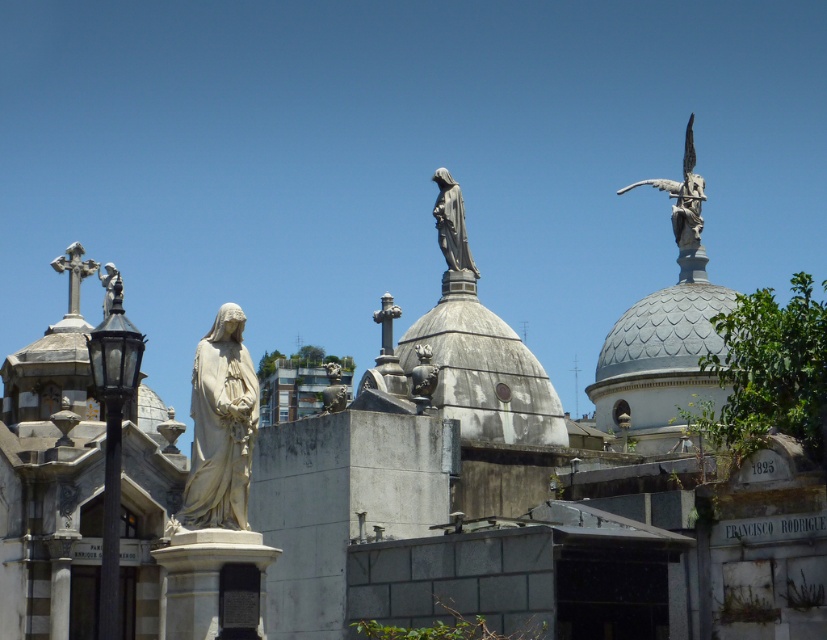
You are a visitor at the cemetery and want to take a photo of the white marble statue at center. To ensure it is the main focus, you need to position yourself so that it is directly in front of you. Given the layout described, where should you stand relative to the other statues and structures in the scene?

The white marble statue at center is located at point (220, 426), so you should stand in a position that aligns with this coordinate to have it directly in front while avoiding obstructions from other statues.

You are an art student observing the cemetery scene. You notice two statues in the center of the image, the white marble statue at center and the polished bronze statue at center. Which one is taller?

The white marble statue at center is much taller than the polished bronze statue at center.

You are standing at the center of the cemetery looking towards the statues. Which statue is located at the point with coordinates (682, 195)?

The point at coordinates (682, 195) corresponds to the polished bronze angel at upper right.